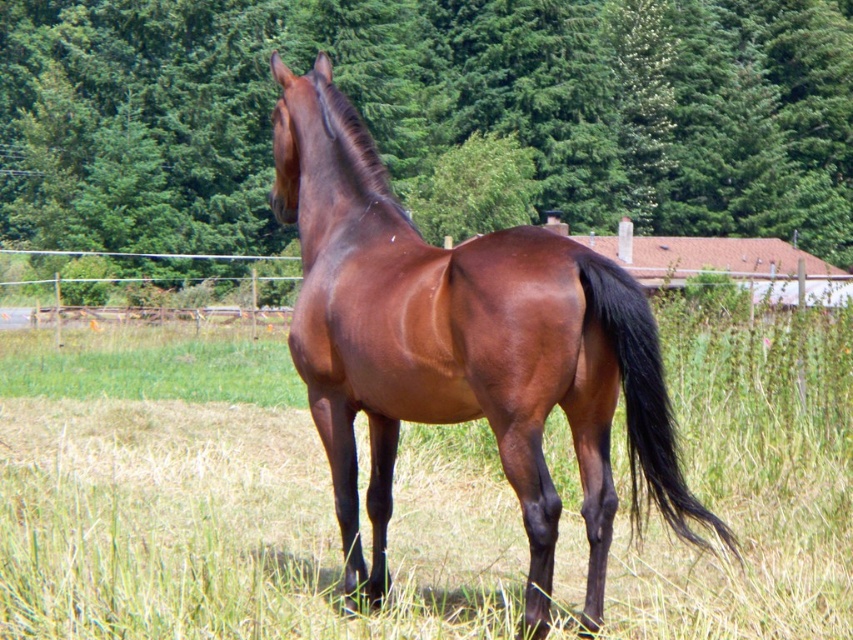
Is point (575, 365) behind point (634, 417)?

Yes, it is behind point (634, 417).

Who is positioned more to the right, shiny brown horse at center or brown glossy tail at center-right?

Positioned to the right is brown glossy tail at center-right.

Image resolution: width=853 pixels, height=640 pixels. What do you see at coordinates (461, 348) in the screenshot?
I see `shiny brown horse at center` at bounding box center [461, 348].

Where is `shiny brown horse at center`? The image size is (853, 640). shiny brown horse at center is located at coordinates (461, 348).

Is point (265, 157) farther from camera compared to point (579, 260)?

Yes.

Is green leafy tree at upper center closer to camera compared to shiny brown horse at center?

No, green leafy tree at upper center is behind shiny brown horse at center.

Does point (227, 54) come in front of point (419, 378)?

No, (227, 54) is further to viewer.

You are a GUI agent. You are given a task and a screenshot of the screen. Output one action in this format:
    pyautogui.click(x=<x>, y=<y>)
    Task: Click on the green leafy tree at upper center
    Image resolution: width=853 pixels, height=640 pixels.
    Given the screenshot: What is the action you would take?
    pyautogui.click(x=428, y=109)

Looking at this image, who is positioned more to the left, green leafy tree at upper center or brown glossy tail at center-right?

brown glossy tail at center-right

Looking at this image, can you confirm if green leafy tree at upper center is positioned above brown glossy tail at center-right?

Correct, green leafy tree at upper center is located above brown glossy tail at center-right.

This screenshot has width=853, height=640. Identify the location of green leafy tree at upper center. (428, 109).

Identify the location of green leafy tree at upper center. (428, 109).